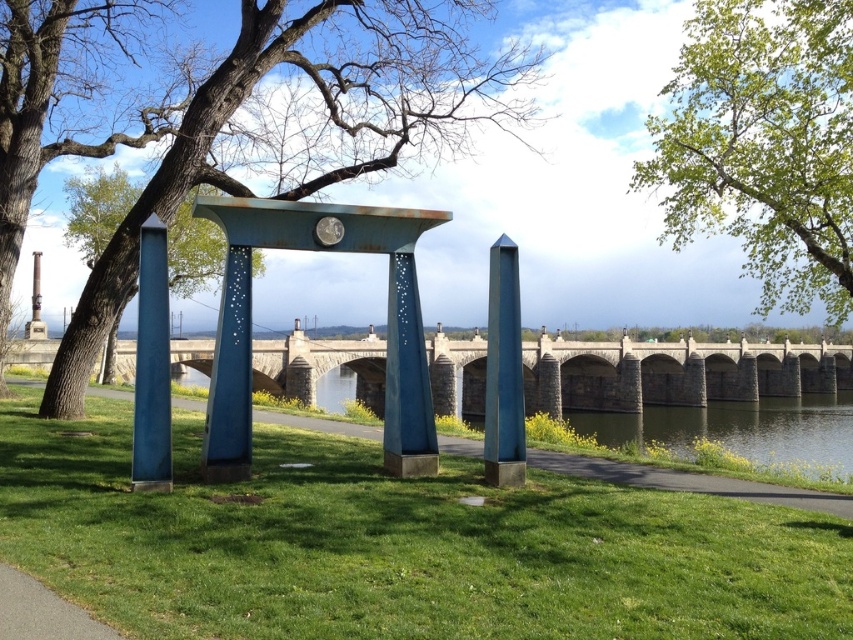
You are an artist planning to paint the scene. You want to emphasize the contrast between the brown bark tree at upper left and the rusty metal pillar at center. Which object should you make larger in your painting to highlight their size difference?

To emphasize the contrast between the brown bark tree at upper left and the rusty metal pillar at center, you should paint the brown bark tree at upper left larger than the rusty metal pillar at center since it has a larger size in reality.

You are standing at the entrance of the gravel path at lower left and want to reach the historic stone bridge in the background. Which direction should you walk relative to the rusty metal pillar at center to stay on the path?

You should walk to the left of the rusty metal pillar at center to stay on the gravel path at lower left since the pillar is positioned on the right side of the path.